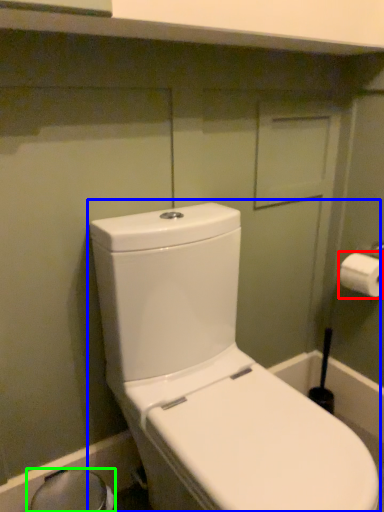
Question: Considering the real-world distances, which object is closest to toilet paper (highlighted by a red box)? toilet (highlighted by a blue box) or bidet (highlighted by a green box).

Choices:
 (A) toilet
 (B) bidet

Answer: (A)